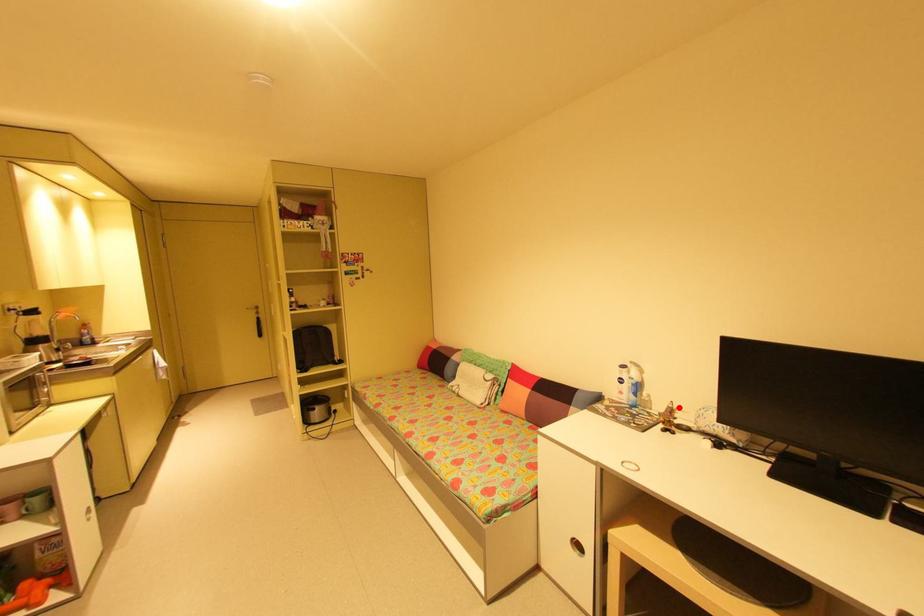
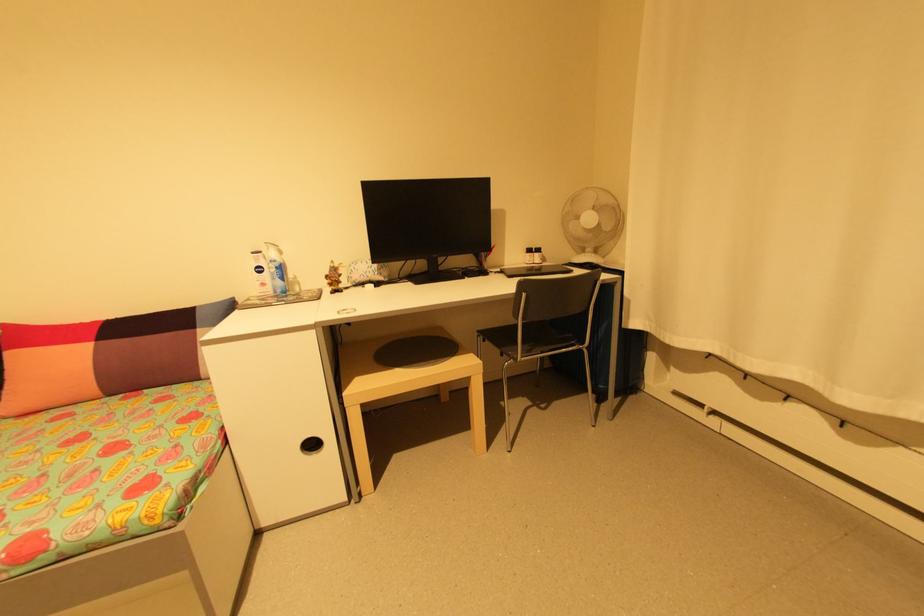
Locate, in the second image, the point that corresponds to the highlighted location in the first image.

(341, 265)